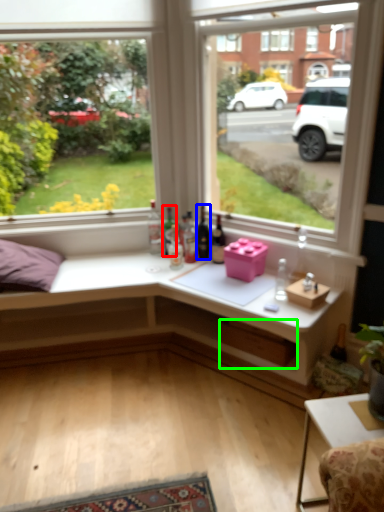
Question: Based on their relative distances, which object is nearer to bottle (highlighted by a red box)? Choose from bottle (highlighted by a blue box) and window box (highlighted by a green box).

Choices:
 (A) bottle
 (B) window box

Answer: (A)